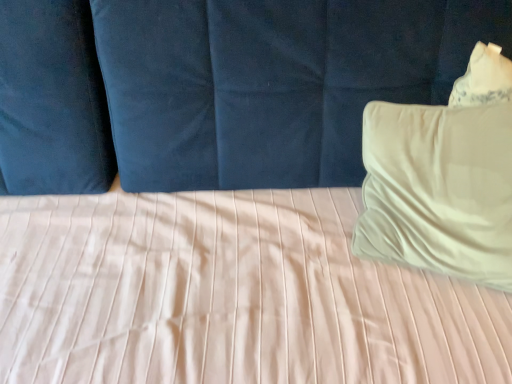
Locate an element on the screen. This screenshot has height=384, width=512. beige soft pillow at right is located at coordinates (439, 189).

The width and height of the screenshot is (512, 384). What do you see at coordinates (439, 189) in the screenshot?
I see `beige soft pillow at right` at bounding box center [439, 189].

Image resolution: width=512 pixels, height=384 pixels. Describe the element at coordinates (217, 87) in the screenshot. I see `matte blue curtain at upper center` at that location.

Measure the distance between point [458,62] and camera.

The depth of point [458,62] is 36.14 inches.

Find the location of `matte blue curtain at upper center`. matte blue curtain at upper center is located at coordinates (217, 87).

Where is `beige soft pillow at right`? beige soft pillow at right is located at coordinates (439, 189).

Consider the image. Between beige soft pillow at right and matte blue curtain at upper center, which one appears on the right side from the viewer's perspective?

beige soft pillow at right is more to the right.

Is the depth of beige soft pillow at right less than that of matte blue curtain at upper center?

That is False.

Is point (399, 124) closer to viewer compared to point (196, 95)?

That is True.

From the image's perspective, which one is positioned lower, beige soft pillow at right or matte blue curtain at upper center?

matte blue curtain at upper center appears lower in the image.

From a real-world perspective, which object rests below the other?

In real-world perspective, matte blue curtain at upper center is lower.

Between beige soft pillow at right and matte blue curtain at upper center, which one has smaller width?

beige soft pillow at right.

Is beige soft pillow at right shorter than matte blue curtain at upper center?

Yes, beige soft pillow at right is shorter than matte blue curtain at upper center.

Does beige soft pillow at right have a smaller size compared to matte blue curtain at upper center?

Indeed, beige soft pillow at right has a smaller size compared to matte blue curtain at upper center.

Choose the correct answer: Is beige soft pillow at right inside matte blue curtain at upper center or outside it?

beige soft pillow at right is contained in matte blue curtain at upper center.

Is beige soft pillow at right positioned far away from matte blue curtain at upper center?

beige soft pillow at right is actually quite close to matte blue curtain at upper center.

Could you tell me if beige soft pillow at right is turned towards matte blue curtain at upper center?

Yes, beige soft pillow at right is turned towards matte blue curtain at upper center.

How many degrees apart are the facing directions of beige soft pillow at right and matte blue curtain at upper center?

The angular difference between beige soft pillow at right and matte blue curtain at upper center is 44.5 degrees.

Image resolution: width=512 pixels, height=384 pixels. I want to click on curtain below the beige soft pillow at right (from the image's perspective), so (217, 87).

Considering the relative positions of matte blue curtain at upper center and beige soft pillow at right in the image provided, is matte blue curtain at upper center to the right of beige soft pillow at right from the viewer's perspective?

In fact, matte blue curtain at upper center is to the left of beige soft pillow at right.

Is matte blue curtain at upper center further to the viewer compared to beige soft pillow at right?

No.

Is point (69, 147) in front of point (407, 138)?

No, (69, 147) is further to viewer.

From the image's perspective, is matte blue curtain at upper center under beige soft pillow at right?

Yes, from the image's perspective, matte blue curtain at upper center is below beige soft pillow at right.

From a real-world perspective, is matte blue curtain at upper center under beige soft pillow at right?

Yes, from a real-world perspective, matte blue curtain at upper center is beneath beige soft pillow at right.

Can you confirm if matte blue curtain at upper center is wider than beige soft pillow at right?

Yes, matte blue curtain at upper center is wider than beige soft pillow at right.

Between matte blue curtain at upper center and beige soft pillow at right, which one has less height?

beige soft pillow at right is shorter.

Can you confirm if matte blue curtain at upper center is smaller than beige soft pillow at right?

No.

Is matte blue curtain at upper center completely or partially outside of beige soft pillow at right?

Yes.

Is matte blue curtain at upper center not close to beige soft pillow at right?

No.

Is matte blue curtain at upper center facing away from beige soft pillow at right?

Correct, matte blue curtain at upper center is looking away from beige soft pillow at right.

How many degrees apart are the facing directions of matte blue curtain at upper center and beige soft pillow at right?

matte blue curtain at upper center and beige soft pillow at right are facing 44.5 degrees away from each other.

The height and width of the screenshot is (384, 512). What are the coordinates of `curtain that appears below the beige soft pillow at right (from a real-world perspective)` in the screenshot? It's located at (217, 87).

In the image, there is a beige soft pillow at right. Where is `curtain below it (from the image's perspective)`? The height and width of the screenshot is (384, 512). curtain below it (from the image's perspective) is located at coordinates (217, 87).

Image resolution: width=512 pixels, height=384 pixels. What are the coordinates of `pillow lying above the matte blue curtain at upper center (from the image's perspective)` in the screenshot? It's located at (439, 189).